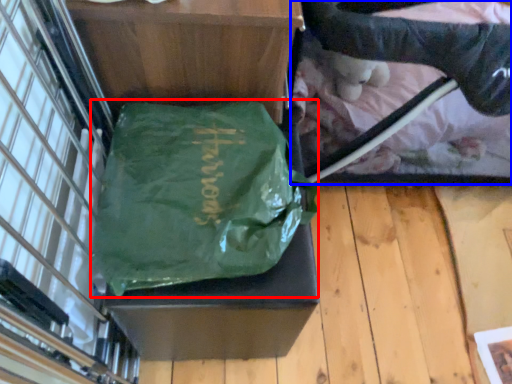
Question: Which object appears closest to the camera in this image, tote bag (highlighted by a red box) or baby carriage (highlighted by a blue box)?

Choices:
 (A) tote bag
 (B) baby carriage

Answer: (A)